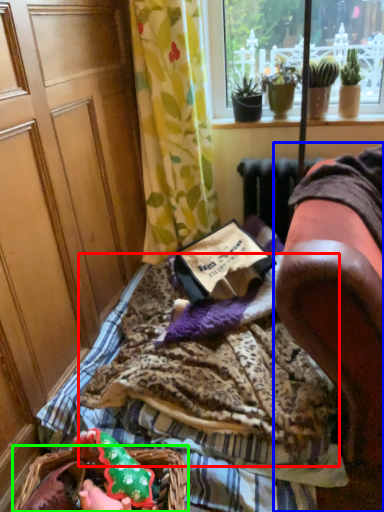
Question: Based on their relative distances, which object is farther from blanket (highlighted by a red box)? Choose from furniture (highlighted by a blue box) and flower basket (highlighted by a green box).

Choices:
 (A) furniture
 (B) flower basket

Answer: (A)